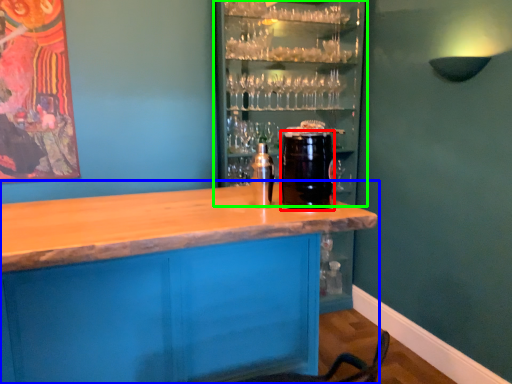
Question: Which object is positioned closest to beverage (highlighted by a red box)? Select from table (highlighted by a blue box) and shelf (highlighted by a green box).

Choices:
 (A) table
 (B) shelf

Answer: (A)